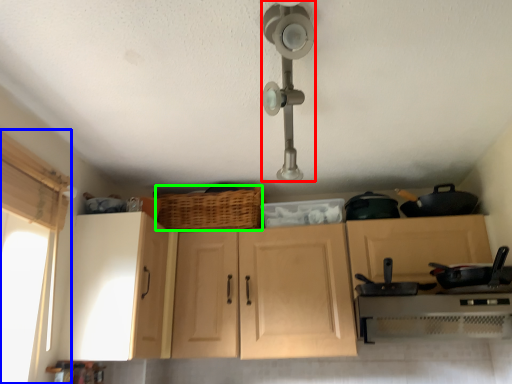
Question: Considering the real-world distances, which object is closest to light fixture (highlighted by a red box)? window screen (highlighted by a blue box) or basket (highlighted by a green box).

Choices:
 (A) window screen
 (B) basket

Answer: (B)